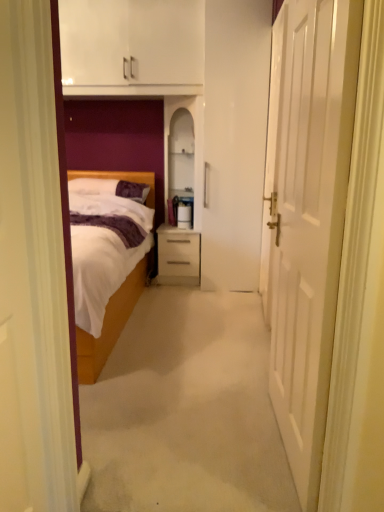
Question: Based on their positions, is white matte door at right located to the left or right of matte white drawer at center?

Choices:
 (A) right
 (B) left

Answer: (A)

Question: In terms of size, does white matte door at right appear bigger or smaller than matte white drawer at center?

Choices:
 (A) small
 (B) big

Answer: (B)

Question: Which object is positioned farthest from the wooden bed at left?

Choices:
 (A) white soft pillow at center
 (B) matte white drawer at center
 (C) white matte door at right

Answer: (C)

Question: Estimate the real-world distances between objects in this image. Which object is closer to the matte white drawer at center?

Choices:
 (A) wooden bed at left
 (B) white matte door at right
 (C) white soft pillow at center

Answer: (C)